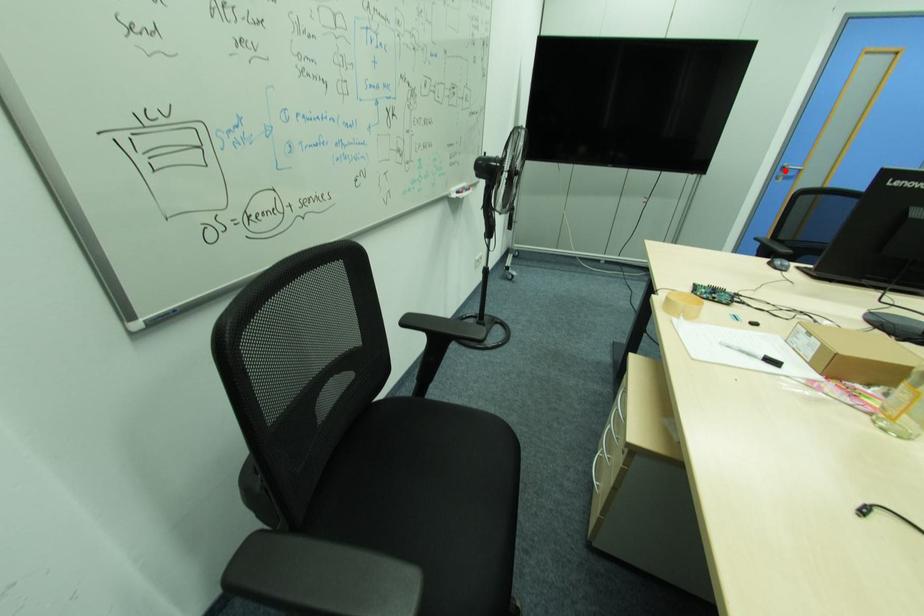
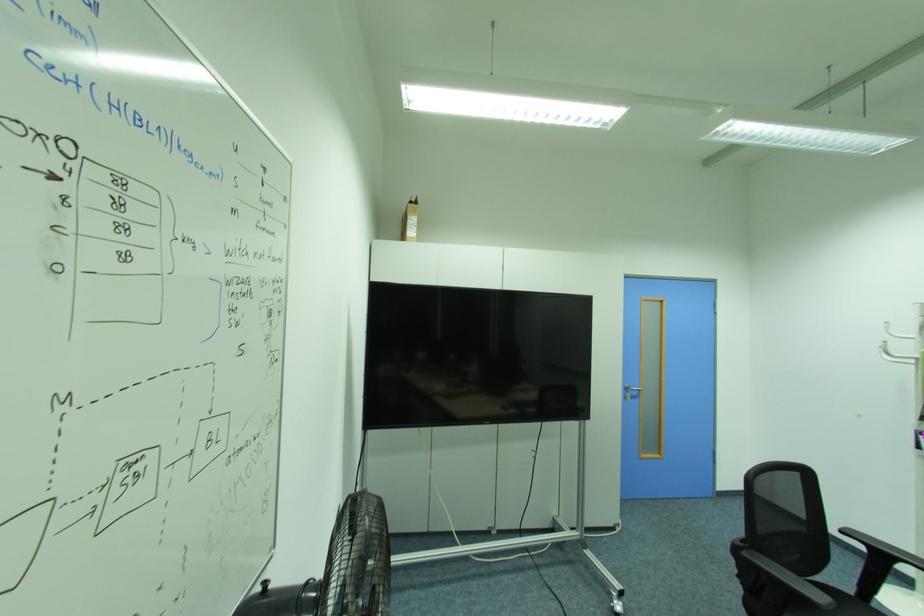
Locate, in the second image, the point that corresponds to the highlighted location in the first image.

(629, 390)